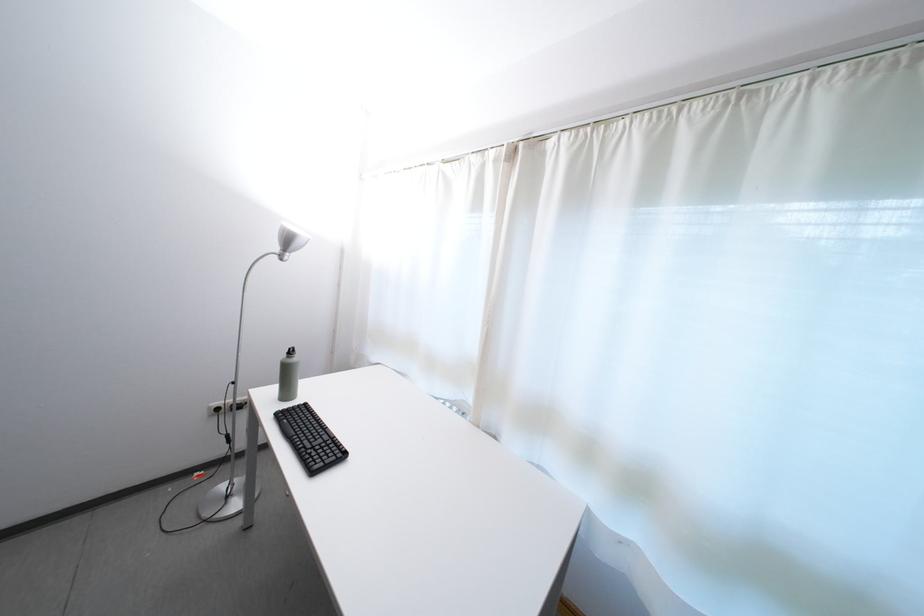
This screenshot has height=616, width=924. I want to click on black keyboard, so click(x=310, y=438).